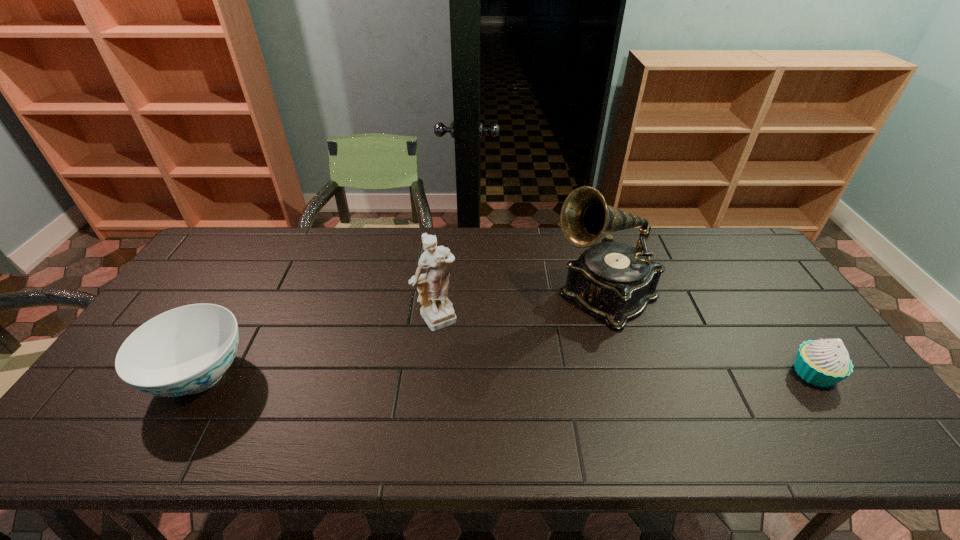
Where is `vacant space on the desktop that is between the chinaware and the rightmost object and is positioned on the front-facing side of the second object from left to right`? The height and width of the screenshot is (540, 960). vacant space on the desktop that is between the chinaware and the rightmost object and is positioned on the front-facing side of the second object from left to right is located at coordinates (484, 374).

Image resolution: width=960 pixels, height=540 pixels. Identify the location of vacant space on the desktop that is between the leftmost object and the cupcake and is positioned on the horn of the phonograph record. (502, 374).